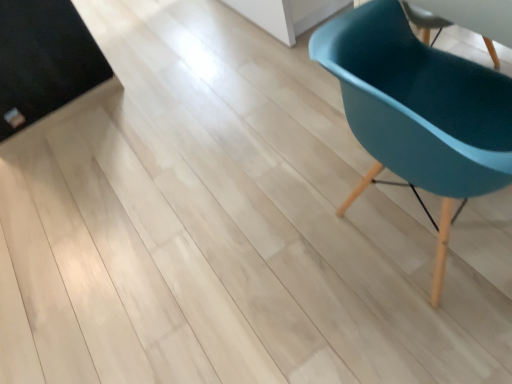
Locate an element on the screen. This screenshot has width=512, height=384. free point below teal plastic chair at right (from a real-world perspective) is located at coordinates pos(426,236).